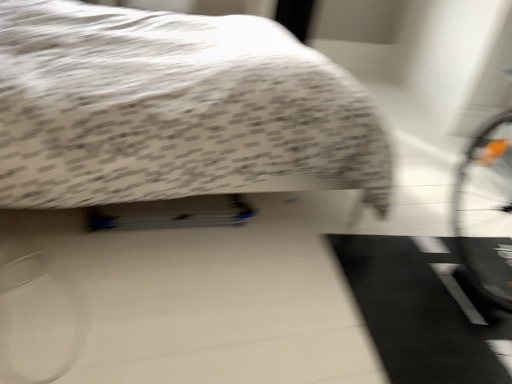
Locate an element on the screen. This screenshot has width=512, height=384. vacant area situated to the left side of black rubber doormat at lower right is located at coordinates (271, 281).